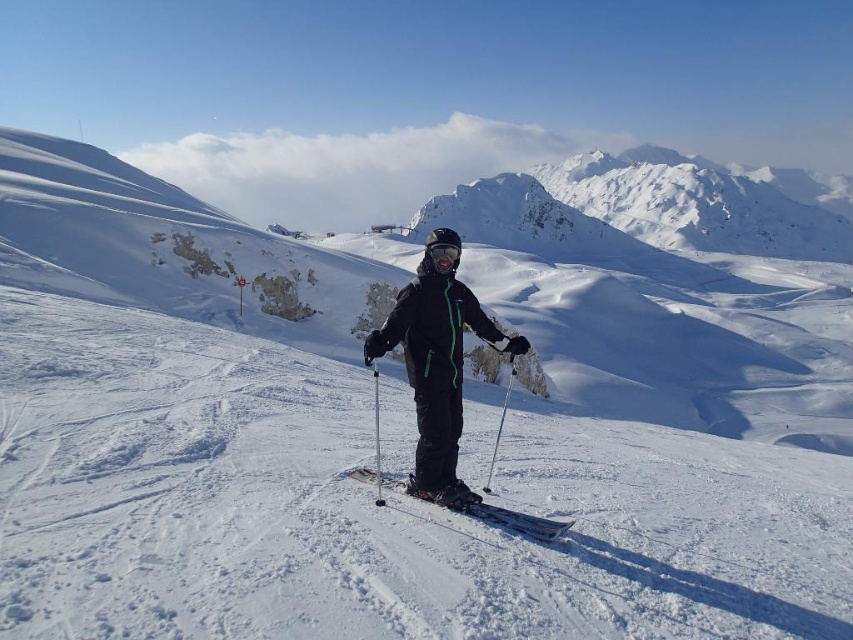
Question: Among these objects, which one is nearest to the camera?

Choices:
 (A) metallic silver ski pole at center
 (B) black matte ski suit at center
 (C) black matte goggles at center
 (D) shiny metallic skis at center

Answer: (A)

Question: In this image, where is snowy granite mountain at upper center located relative to shiny metallic skis at center?

Choices:
 (A) right
 (B) left

Answer: (A)

Question: Considering the relative positions of snowy granite mountain at upper center and shiny metallic skis at center in the image provided, where is snowy granite mountain at upper center located with respect to shiny metallic skis at center?

Choices:
 (A) left
 (B) right

Answer: (B)

Question: Can you confirm if snowy granite mountain at upper center is bigger than metallic silver ski pole at center?

Choices:
 (A) no
 (B) yes

Answer: (B)

Question: Which object is the closest to the snowy granite mountain at upper center?

Choices:
 (A) metallic silver ski pole at center
 (B) black matte goggles at center

Answer: (A)

Question: Which point is farther to the camera?

Choices:
 (A) (374, 416)
 (B) (669, 209)

Answer: (B)